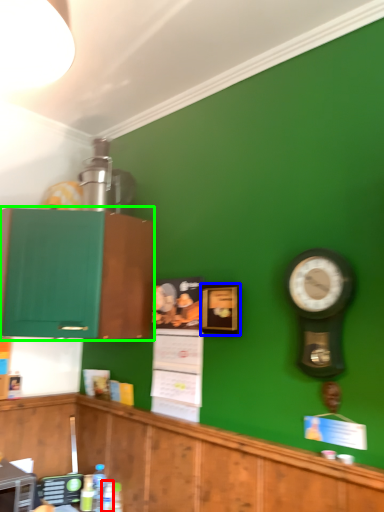
Question: Estimate the real-world distances between objects in this image. Which object is farther from bottle (highlighted by a red box), picture frame (highlighted by a blue box) or cabinetry (highlighted by a green box)?

Choices:
 (A) picture frame
 (B) cabinetry

Answer: (A)